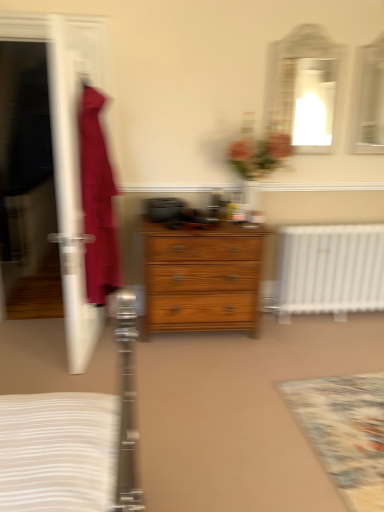
Question: From a real-world perspective, is transparent plastic screen door at left positioned above or below floral carpet at lower right?

Choices:
 (A) above
 (B) below

Answer: (A)

Question: From the image's perspective, is transparent plastic screen door at left located above or below floral carpet at lower right?

Choices:
 (A) below
 (B) above

Answer: (B)

Question: Estimate the real-world distances between objects in this image. Which object is farther from the wooden chest of drawers at center?

Choices:
 (A) floral carpet at lower right
 (B) matte glass mirror at upper center, which is the first mirror in right-to-left order
 (C) matte white mirror at upper right, which appears as the 2th mirror when viewed from the right
 (D) transparent plastic screen door at left

Answer: (B)

Question: Based on their relative distances, which object is farther from the matte glass mirror at upper center, the 2th mirror when ordered from left to right?

Choices:
 (A) wooden chest of drawers at center
 (B) floral carpet at lower right
 (C) matte white mirror at upper right, which is the 1th mirror in left-to-right order
 (D) transparent plastic screen door at left

Answer: (D)